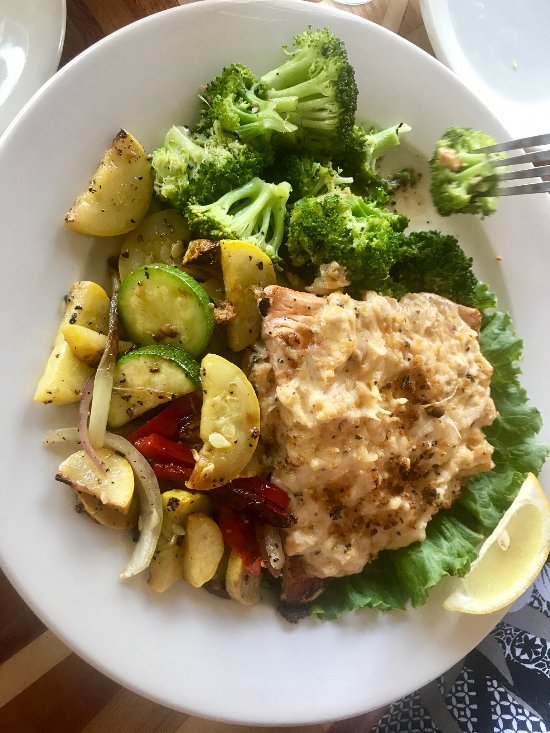
Find the location of a particular element. This screenshot has width=550, height=733. white plate is located at coordinates (7, 17).